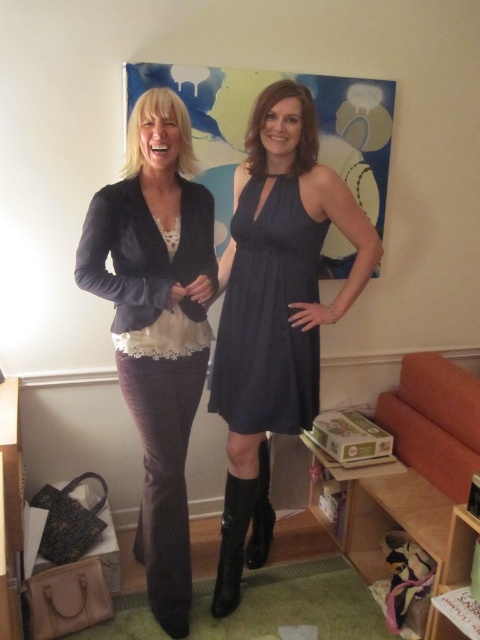
Is velvet blazer at left in front of black leather boot at lower center?

Yes, velvet blazer at left is closer to the viewer.

Does velvet blazer at left have a greater width compared to black leather boot at lower center?

→ Indeed, velvet blazer at left has a greater width compared to black leather boot at lower center.

Where is `velvet blazer at left`? velvet blazer at left is located at coordinates (156, 324).

What do you see at coordinates (276, 300) in the screenshot?
I see `denim dress at center` at bounding box center [276, 300].

Between denim dress at center and black leather boot at lower center, which one is positioned higher?

denim dress at center is above.

In order to click on denim dress at center in this screenshot , I will do 276,300.

Does denim dress at center have a lesser width compared to dark blue textured dress at center?

In fact, denim dress at center might be wider than dark blue textured dress at center.

Can you confirm if denim dress at center is positioned below dark blue textured dress at center?

Correct, denim dress at center is located below dark blue textured dress at center.

Locate an element on the screen. denim dress at center is located at coordinates (276, 300).

Find the location of a particular element. Image resolution: width=480 pixels, height=640 pixels. denim dress at center is located at coordinates (276, 300).